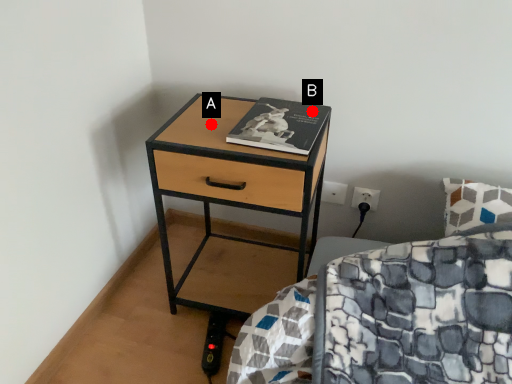
Question: Two points are circled on the image, labeled by A and B beside each circle. Among these points, which one is nearest to the camera?

Choices:
 (A) A is closer
 (B) B is closer

Answer: (A)